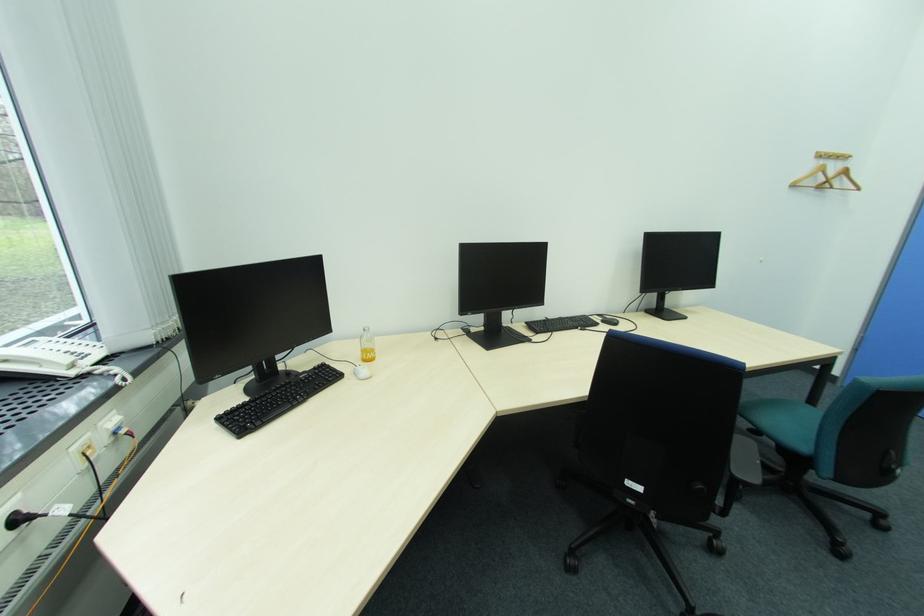
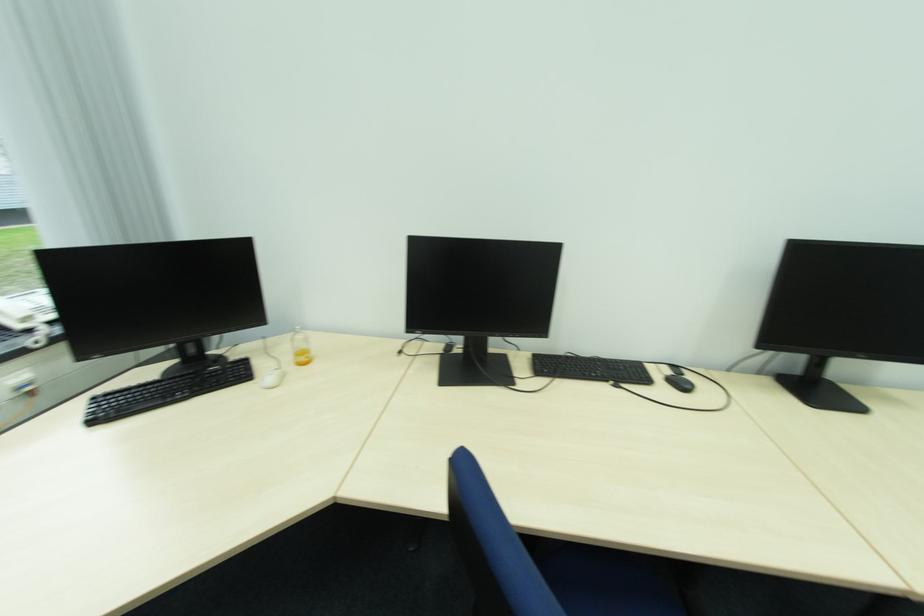
The point at (374, 346) is marked in the first image. Where is the corresponding point in the second image?

(310, 347)